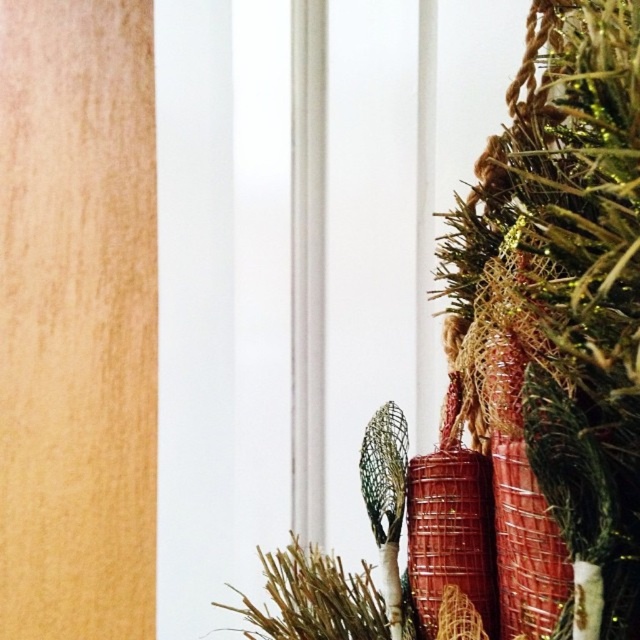
Question: Which point appears closest to the camera in this image?

Choices:
 (A) (538, 236)
 (B) (476, 508)

Answer: (A)

Question: Does shiny metallic ornament at upper right have a larger size compared to shiny gold tinsel at right?

Choices:
 (A) yes
 (B) no

Answer: (A)

Question: Is shiny metallic ornament at upper right to the left of shiny gold tinsel at right from the viewer's perspective?

Choices:
 (A) yes
 (B) no

Answer: (A)

Question: Which point appears closest to the camera in this image?

Choices:
 (A) (621, 387)
 (B) (493, 260)

Answer: (A)

Question: Does shiny metallic ornament at upper right appear on the right side of shiny gold tinsel at right?

Choices:
 (A) yes
 (B) no

Answer: (B)

Question: Which point is closer to the camera?

Choices:
 (A) shiny gold tinsel at right
 (B) shiny metallic ornament at upper right

Answer: (A)